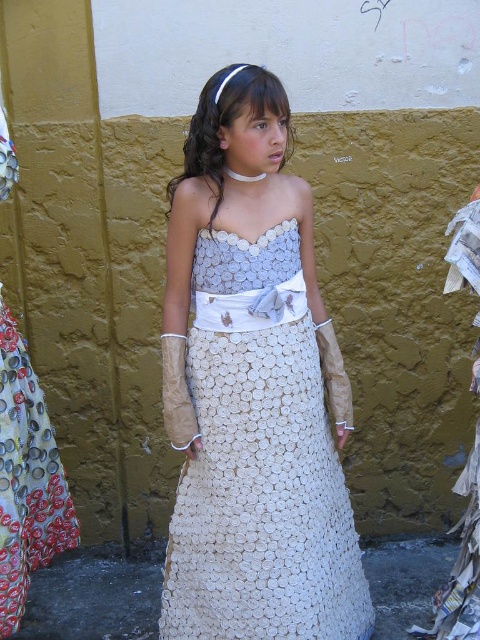
Does white textured dress at center have a greater width compared to white textured fabric dress at center?

Indeed, white textured dress at center has a greater width compared to white textured fabric dress at center.

Is white textured dress at center shorter than white textured fabric dress at center?

In fact, white textured dress at center may be taller than white textured fabric dress at center.

Where is `white textured dress at center`? This screenshot has height=640, width=480. white textured dress at center is located at coordinates (252, 388).

In order to click on white textured dress at center in this screenshot , I will do click(x=252, y=388).